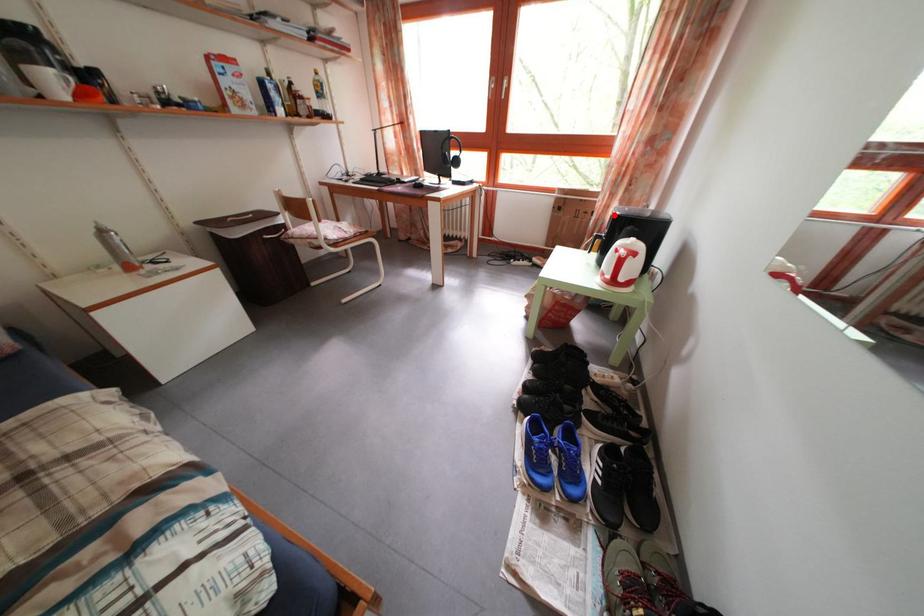
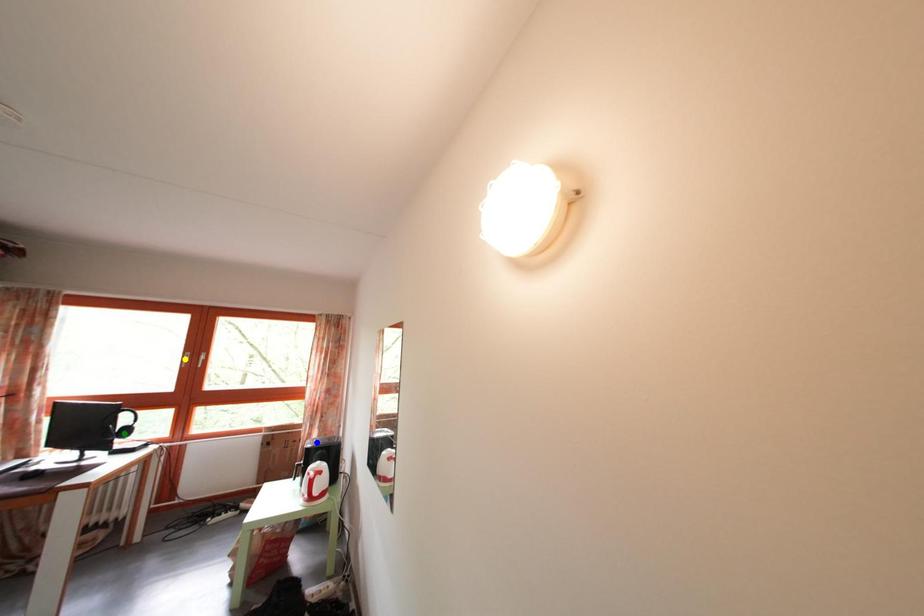
Question: I am providing you with two images of the same scene from different viewpoints. A red point is marked on the first image. You are given multiple points on the second image. In image 2, which mark is for the same physical point as the one in image 1?

Choices:
 (A) yellow point
 (B) blue point
 (C) green point

Answer: (B)